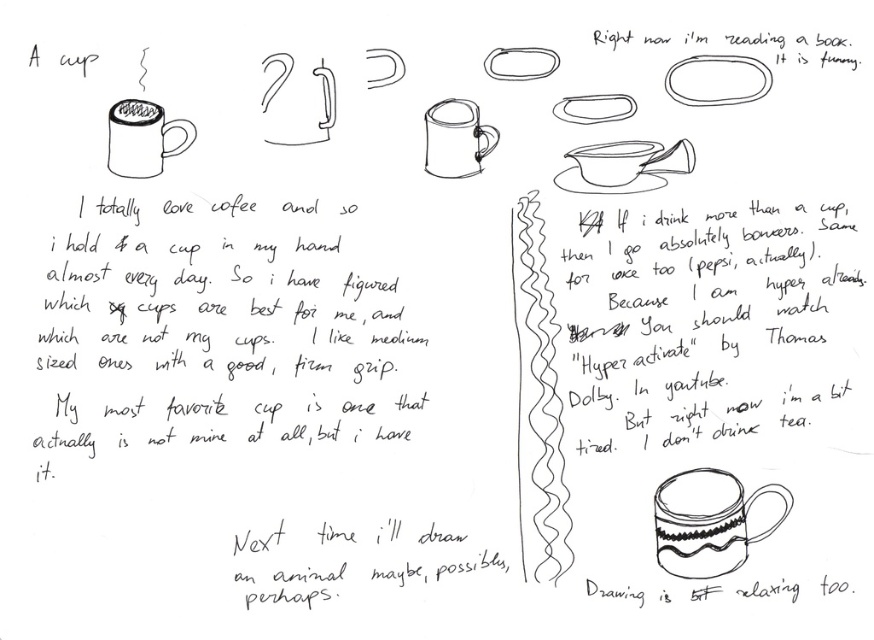
Which is behind, point (726, 564) or point (429, 161)?

The point (429, 161) is more distant.

Where is `speckled ceramic mug at lower right`? The width and height of the screenshot is (874, 640). speckled ceramic mug at lower right is located at coordinates (709, 525).

What do you see at coordinates (709, 525) in the screenshot?
I see `speckled ceramic mug at lower right` at bounding box center [709, 525].

You are a GUI agent. You are given a task and a screenshot of the screen. Output one action in this format:
    pyautogui.click(x=<x>, y=<y>)
    Task: Click on the speckled ceramic mug at lower right
    The height and width of the screenshot is (640, 874).
    Given the screenshot: What is the action you would take?
    pyautogui.click(x=709, y=525)

Can you confirm if black paper at upper center is positioned to the left of matte ceramic mug at upper left?

Incorrect, black paper at upper center is not on the left side of matte ceramic mug at upper left.

Looking at this image, measure the distance between black paper at upper center and matte ceramic mug at upper left.

black paper at upper center and matte ceramic mug at upper left are 49.27 centimeters apart from each other.

In order to click on black paper at upper center in this screenshot , I will do `click(720, 330)`.

Is matte ceramic mug at upper left further to the viewer compared to matte ceramic mug at center?

No.

Is matte ceramic mug at upper left shorter than matte ceramic mug at center?

No, matte ceramic mug at upper left is not shorter than matte ceramic mug at center.

What do you see at coordinates (142, 138) in the screenshot? I see `matte ceramic mug at upper left` at bounding box center [142, 138].

Identify the location of matte ceramic mug at upper left. (142, 138).